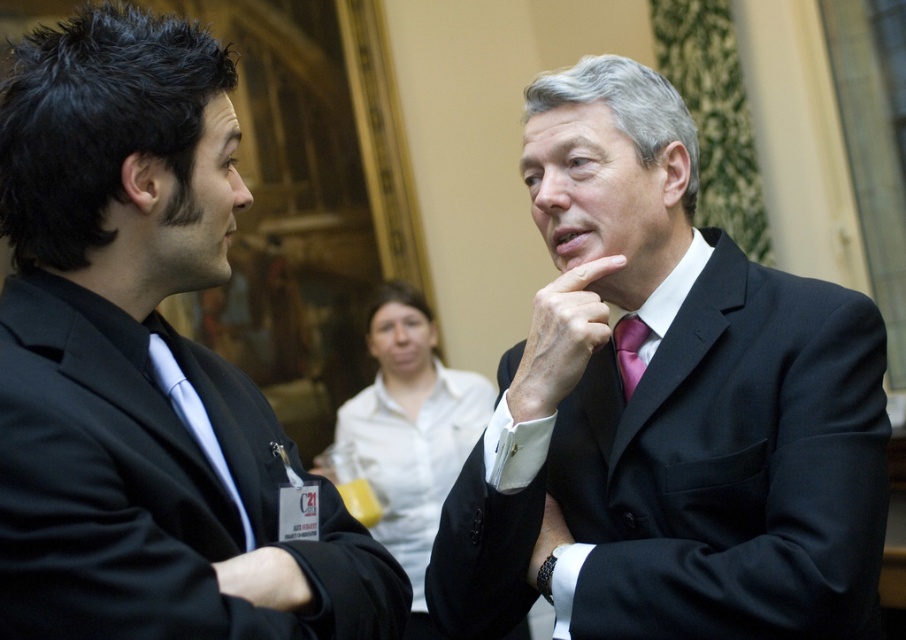
Is black suit at center closer to camera compared to pink satin tie at center?

That is True.

Consider the image. Is black suit at center to the left of pink satin tie at center from the viewer's perspective?

Yes, black suit at center is to the left of pink satin tie at center.

Does point (567, 145) come farther from viewer compared to point (634, 355)?

No, it is in front of (634, 355).

Identify the location of black suit at center. This screenshot has height=640, width=906. (664, 410).

Who is shorter, matte black suit at left or smooth skin hand at center?

smooth skin hand at center

Measure the distance between point (109, 502) and camera.

The distance of point (109, 502) from camera is 4.05 feet.

Locate an element on the screen. This screenshot has height=640, width=906. matte black suit at left is located at coordinates (143, 365).

Between point (873, 480) and point (524, 362), which one is positioned in front?

Point (873, 480)

Between black suit at center and smooth skin hand at center, which one appears on the right side from the viewer's perspective?

black suit at center

Where is `black suit at center`? This screenshot has width=906, height=640. black suit at center is located at coordinates (664, 410).